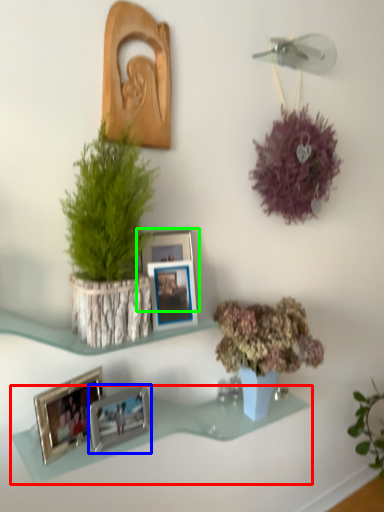
Question: Which is farther away from shelf (highlighted by a red box)? picture frame (highlighted by a blue box) or picture frame (highlighted by a green box)?

Choices:
 (A) picture frame
 (B) picture frame

Answer: (B)